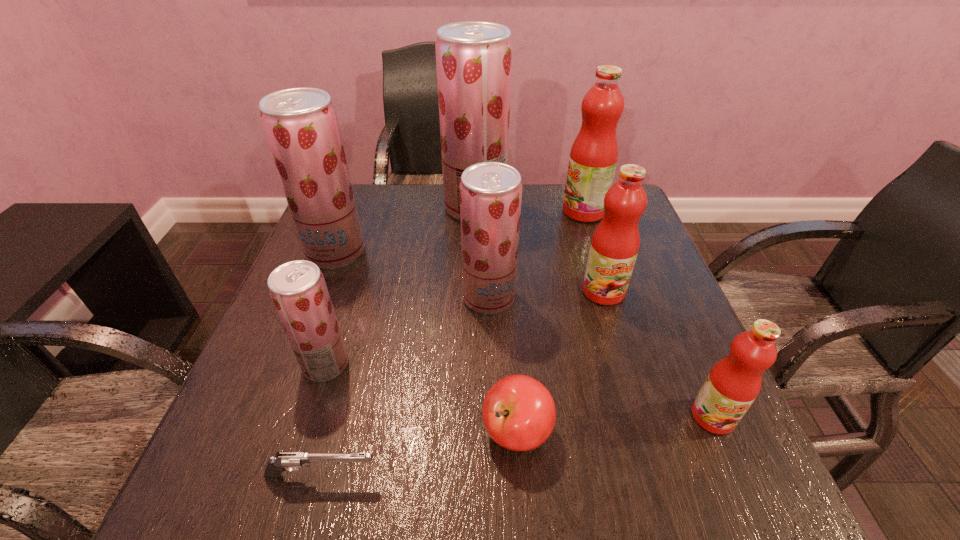
Identify the location of the rightmost pink fruit juice. This screenshot has width=960, height=540. (734, 382).

Where is `apple`? The width and height of the screenshot is (960, 540). apple is located at coordinates (519, 414).

Image resolution: width=960 pixels, height=540 pixels. Identify the location of the eighth tallest object. [519, 414].

Find the location of a particular element. pistol is located at coordinates (291, 461).

Where is `the nearest object`? This screenshot has width=960, height=540. the nearest object is located at coordinates (291, 461).

This screenshot has height=540, width=960. Find the location of `vacant space situated 0.220m on the front of the farthest strawberry fruit juice`. vacant space situated 0.220m on the front of the farthest strawberry fruit juice is located at coordinates click(x=474, y=282).

This screenshot has height=540, width=960. Find the location of `free location located 0.080m on the front label of the biggest pink fruit juice`. free location located 0.080m on the front label of the biggest pink fruit juice is located at coordinates (533, 211).

What are the coordinates of `free space located 0.170m on the front label of the biggest pink fruit juice` in the screenshot? It's located at (501, 211).

At what (x,y) coordinates should I click in order to perform the action: click on vacant space situated 0.100m on the front label of the biggest pink fruit juice. Please return your answer as a coordinate pair (x, y). Looking at the image, I should click on (526, 211).

The height and width of the screenshot is (540, 960). Identify the location of vacant space located 0.170m on the back of the third farthest object. (356, 199).